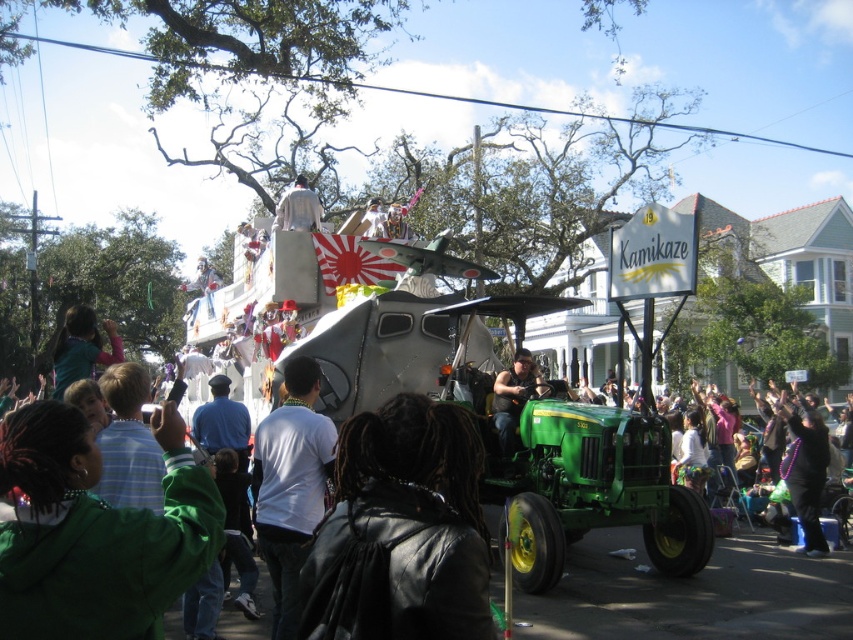
Which is more to the left, white shirt at center or black leather jacket at lower right?

white shirt at center is more to the left.

Is point (299, 516) closer to camera compared to point (788, 448)?

Yes, point (299, 516) is in front of point (788, 448).

Where is `white shirt at center`? white shirt at center is located at coordinates (289, 484).

Where is `white shirt at center`? This screenshot has width=853, height=640. white shirt at center is located at coordinates (289, 484).

Is green fabric shirt at lower left to the left of white fabric at upper center from the viewer's perspective?

Yes, green fabric shirt at lower left is to the left of white fabric at upper center.

Between green fabric shirt at lower left and white fabric at upper center, which one is positioned lower?

green fabric shirt at lower left is below.

Identify the location of green fabric shirt at lower left. The image size is (853, 640). (80, 348).

Is green matte jacket at lower left wider than black leather jacket at lower right?

Indeed, green matte jacket at lower left has a greater width compared to black leather jacket at lower right.

Who is more distant from viewer, (35,556) or (790,451)?

The point (790,451) is behind.

Who is more forward, (16, 541) or (791, 417)?

Point (16, 541) is more forward.

Locate an element on the screen. green matte jacket at lower left is located at coordinates (96, 531).